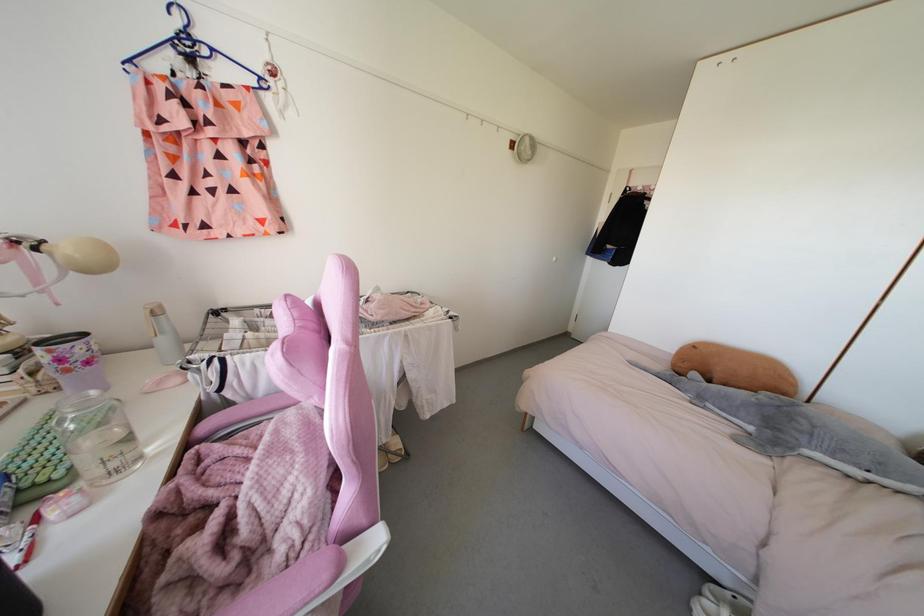
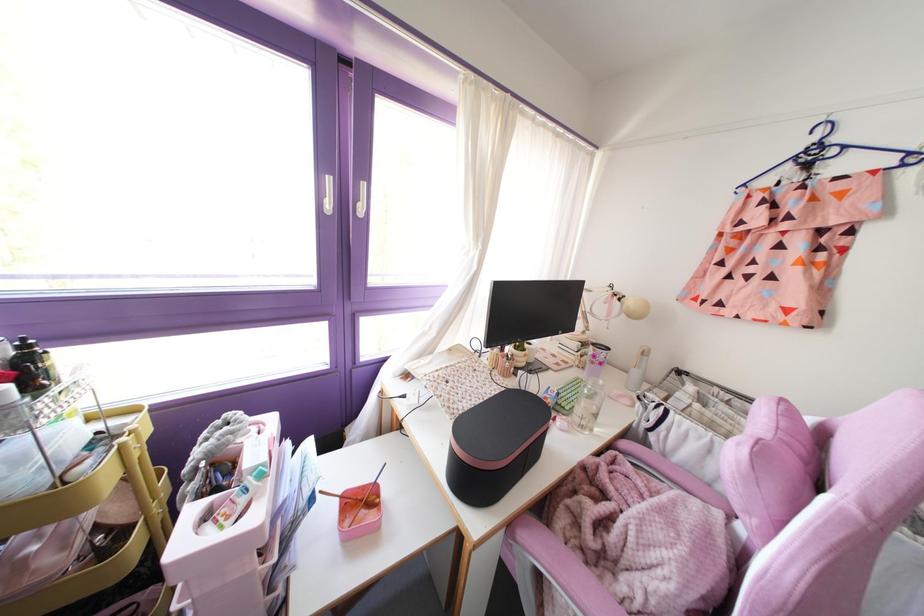
Where in the second image is the point corresponding to the point at 163,341 from the first image?

(634, 371)